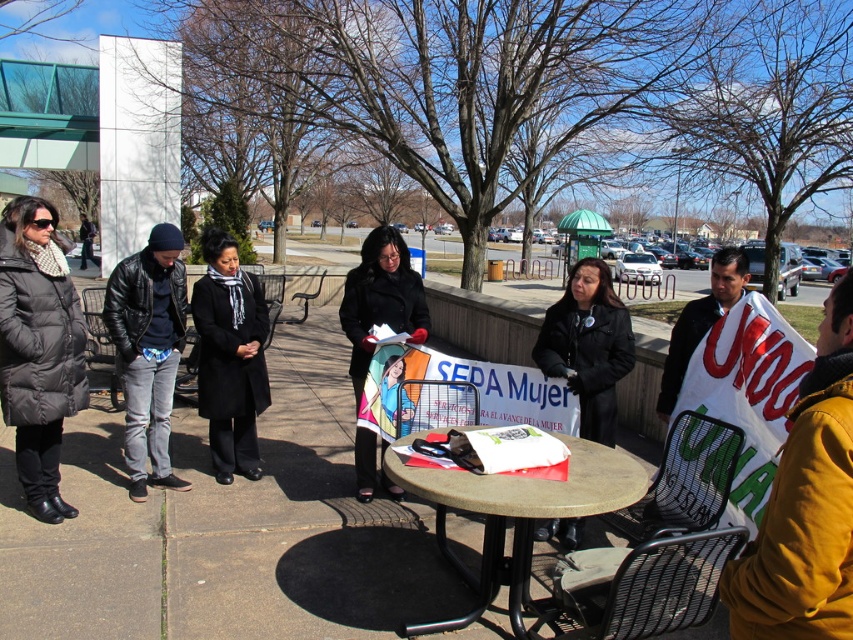
Question: Which object is positioned closest to the black leather jacket at center?

Choices:
 (A) black wool coat at center
 (B) concrete table at center
 (C) black matte coat at center
 (D) black puffer coat at left

Answer: (B)

Question: In this image, where is black puffer coat at left located relative to black matte coat at center?

Choices:
 (A) above
 (B) below

Answer: (A)

Question: Which object is positioned farthest from the white cotton shirt at center?

Choices:
 (A) leather jacket at center
 (B) black wool coat at center
 (C) black matte coat at center

Answer: (A)

Question: Does yellow fabric at lower right have a larger size compared to concrete table at center?

Choices:
 (A) no
 (B) yes

Answer: (A)

Question: Considering the relative positions of yellow fabric at lower right and leather jacket at center in the image provided, where is yellow fabric at lower right located with respect to leather jacket at center?

Choices:
 (A) above
 (B) below

Answer: (B)

Question: Among these objects, which one is farthest from the camera?

Choices:
 (A) black matte coat at center
 (B) yellow fabric at lower right

Answer: (A)